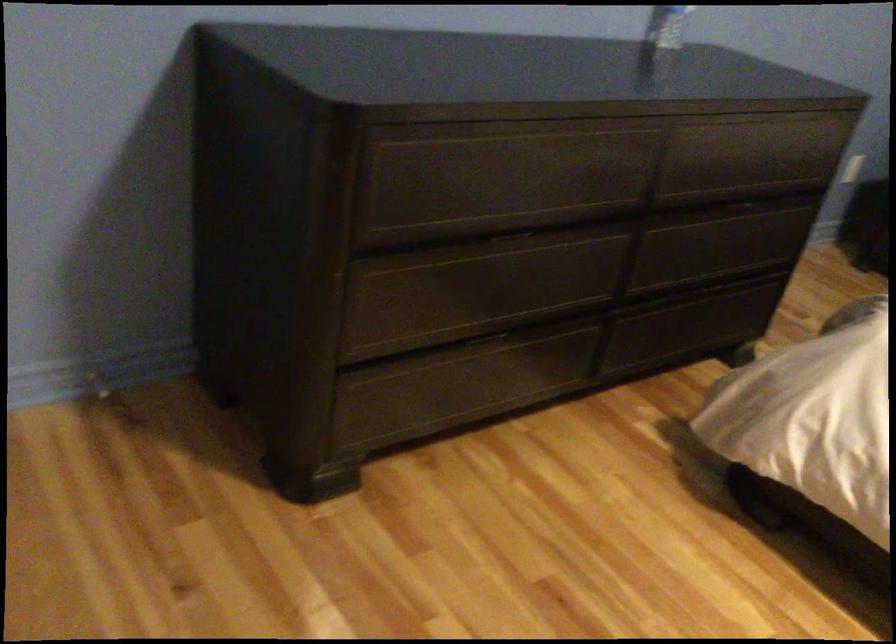
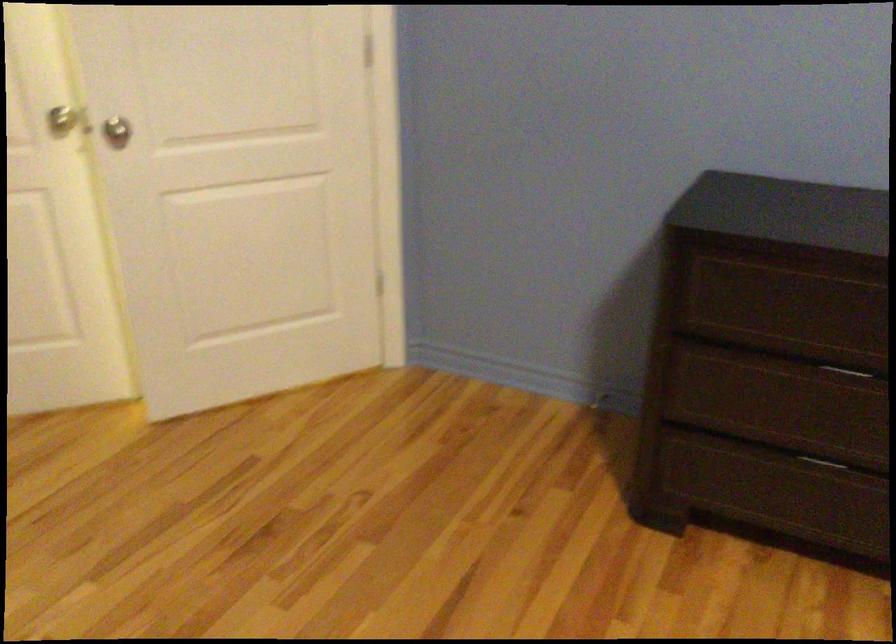
Locate, in the second image, the point that corresponds to [474,342] in the first image.

(821, 462)